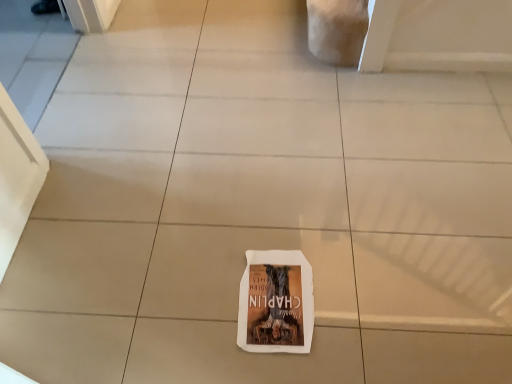
Image resolution: width=512 pixels, height=384 pixels. I want to click on vacant region in front of white paper flyer at center, so pyautogui.click(x=280, y=364).